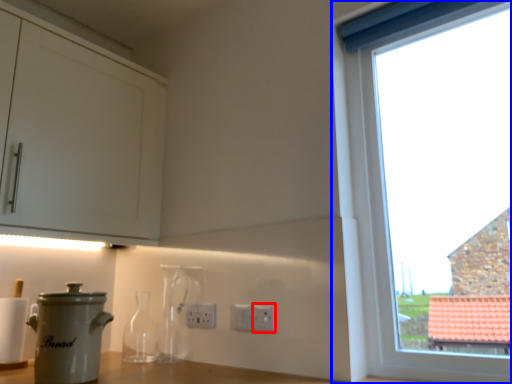
Question: Which object appears closest to the camera in this image, electric outlet (highlighted by a red box) or window (highlighted by a blue box)?

Choices:
 (A) electric outlet
 (B) window

Answer: (B)